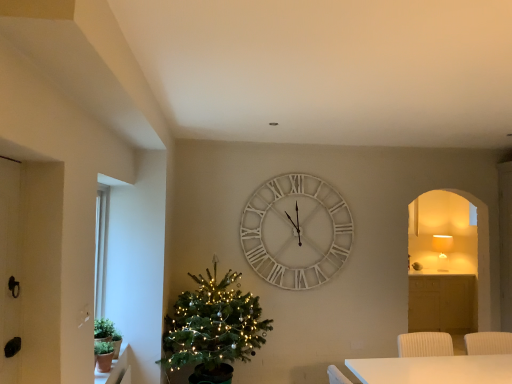
Question: Is terracotta clay pot at lower left wider than green matte christmas tree at left?

Choices:
 (A) no
 (B) yes

Answer: (A)

Question: Is terracotta clay pot at lower left positioned beyond the bounds of green matte christmas tree at left?

Choices:
 (A) yes
 (B) no

Answer: (A)

Question: Does terracotta clay pot at lower left have a smaller size compared to green matte christmas tree at left?

Choices:
 (A) no
 (B) yes

Answer: (B)

Question: From the image's perspective, is terracotta clay pot at lower left located above green matte christmas tree at left?

Choices:
 (A) no
 (B) yes

Answer: (A)

Question: Is terracotta clay pot at lower left closer to camera compared to green matte christmas tree at left?

Choices:
 (A) yes
 (B) no

Answer: (A)

Question: From their relative heights in the image, would you say white wooden clock at center is taller or shorter than matte white lampshade at right?

Choices:
 (A) tall
 (B) short

Answer: (A)

Question: Is white wooden clock at center wider or thinner than matte white lampshade at right?

Choices:
 (A) thin
 (B) wide

Answer: (A)

Question: Which is correct: white wooden clock at center is inside matte white lampshade at right, or outside of it?

Choices:
 (A) outside
 (B) inside

Answer: (A)

Question: In the image, is white wooden clock at center positioned in front of or behind matte white lampshade at right?

Choices:
 (A) behind
 (B) front

Answer: (B)

Question: Considering the positions of matte white lampshade at right and white wooden clock at center in the image, is matte white lampshade at right bigger or smaller than white wooden clock at center?

Choices:
 (A) small
 (B) big

Answer: (A)

Question: Is matte white lampshade at right wider or thinner than white wooden clock at center?

Choices:
 (A) thin
 (B) wide

Answer: (B)

Question: Is matte white lampshade at right situated inside white wooden clock at center or outside?

Choices:
 (A) inside
 (B) outside

Answer: (B)

Question: Relative to white wooden clock at center, is matte white lampshade at right in front or behind?

Choices:
 (A) behind
 (B) front

Answer: (A)

Question: From the image's perspective, relative to white wooden clock at center, is terracotta clay pot at lower left above or below?

Choices:
 (A) below
 (B) above

Answer: (A)

Question: Is terracotta clay pot at lower left taller or shorter than white wooden clock at center?

Choices:
 (A) short
 (B) tall

Answer: (A)